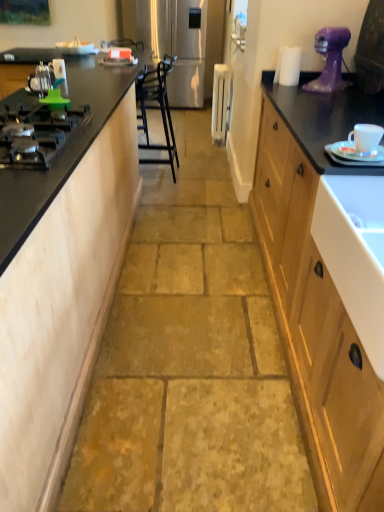
At what (x,y) coordinates should I click in order to perform the action: click on free space above white glossy saucer at right (from a real-world perspective). Please return your answer as a coordinate pair (x, y). Looking at the image, I should click on [x=344, y=150].